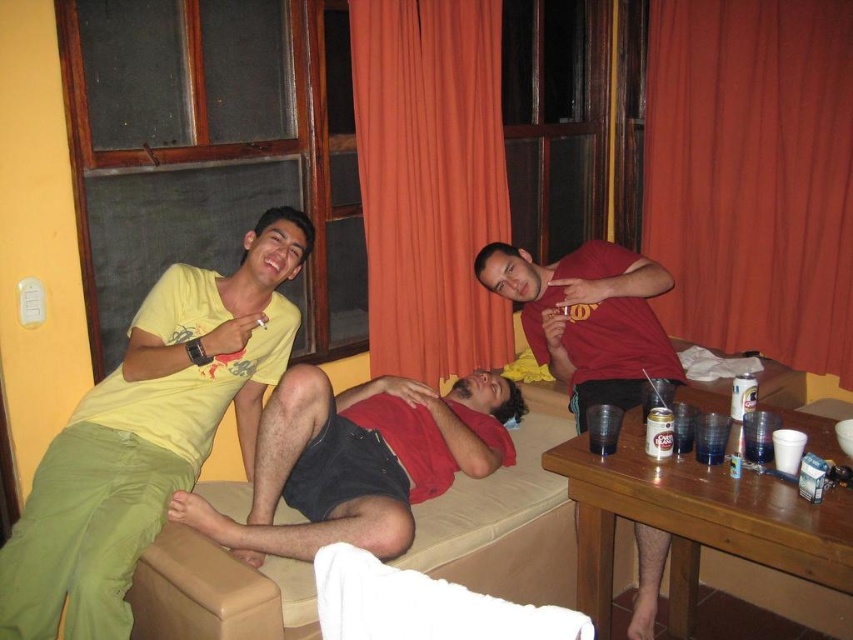
In the scene shown: You are a guest at this event and want to get a drink from the table. You need to walk around the orange fabric curtain at center and the matte red shirt at center. Which object should you go around first to reach the table?

You should go around the matte red shirt at center first because it is behind the orange fabric curtain at center, so the orange fabric curtain is closer to you and you need to navigate around it first before reaching the matte red shirt.